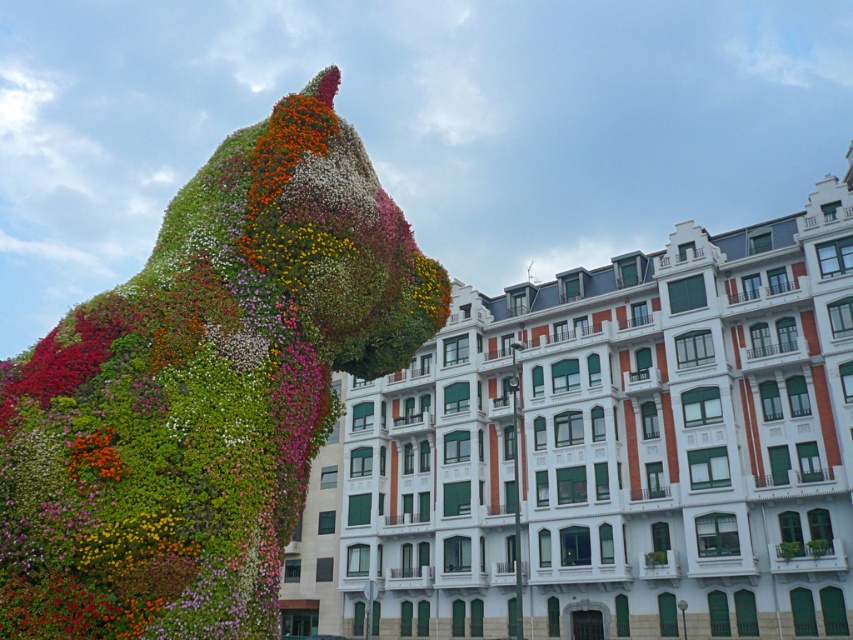
The width and height of the screenshot is (853, 640). What are the coordinates of `white stone building at center` in the screenshot? It's located at (621, 448).

What do you see at coordinates (621, 448) in the screenshot?
I see `white stone building at center` at bounding box center [621, 448].

The height and width of the screenshot is (640, 853). In order to click on white stone building at center in this screenshot , I will do pos(621,448).